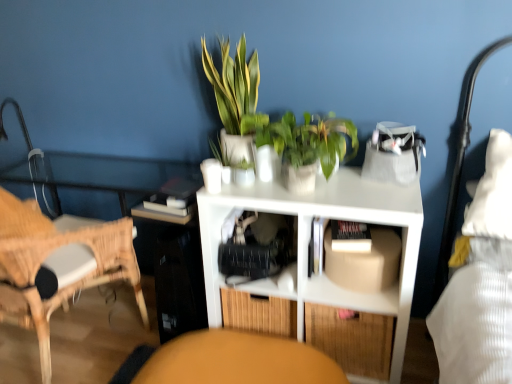
Where is `free area below woven wood chair at left (from a real-world perspective)`? This screenshot has width=512, height=384. free area below woven wood chair at left (from a real-world perspective) is located at coordinates (73, 347).